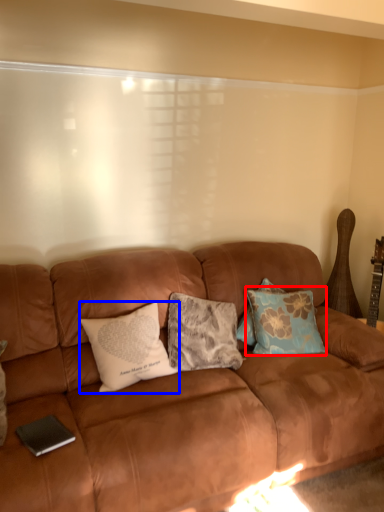
Question: Which object appears farthest to the camera in this image, pillow (highlighted by a red box) or pillow (highlighted by a blue box)?

Choices:
 (A) pillow
 (B) pillow

Answer: (A)